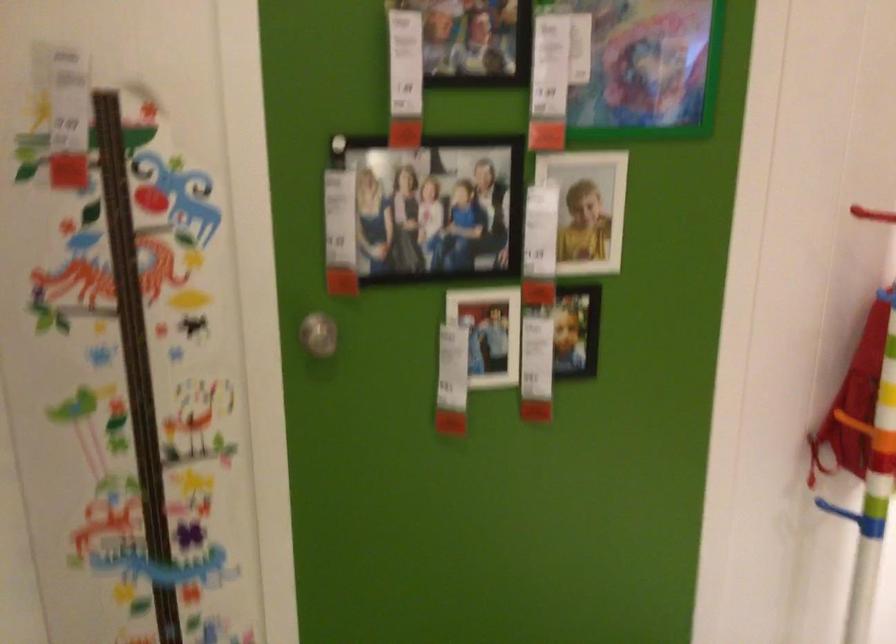
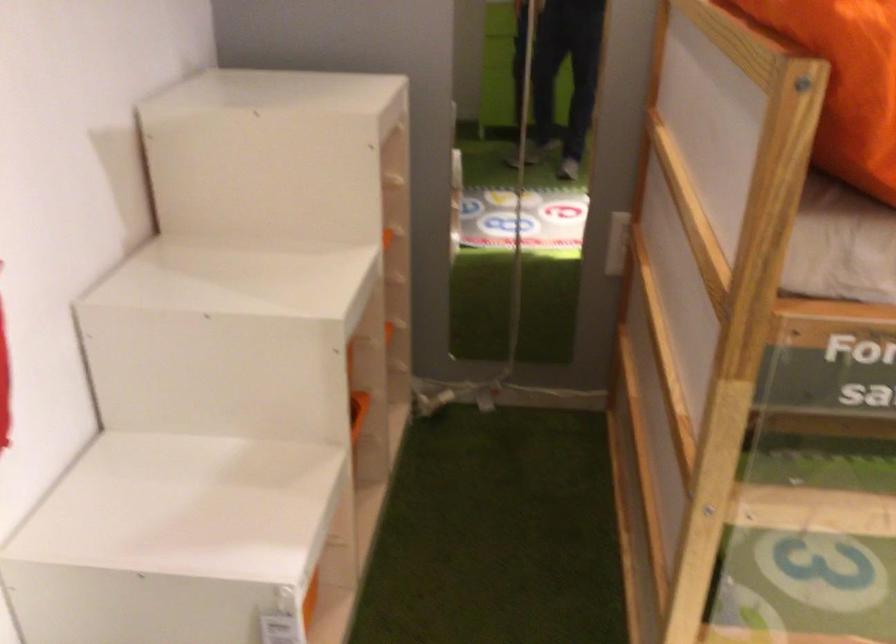
The images are taken continuously from a first-person perspective. In which direction is your viewpoint rotating?

The camera's rotation is toward right-down.